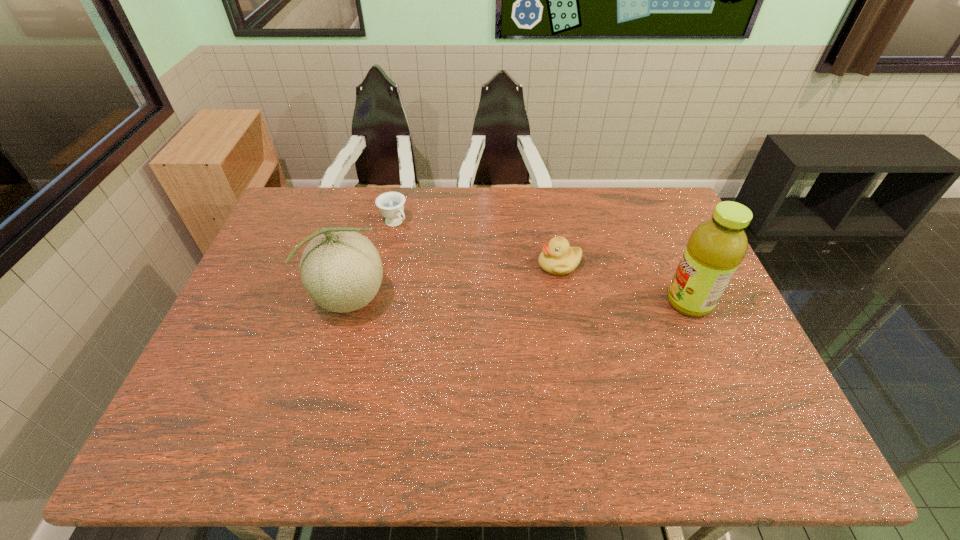
This screenshot has width=960, height=540. I want to click on cantaloup, so click(341, 270).

This screenshot has height=540, width=960. I want to click on fruit juice, so coord(716,247).

Locate an element on the screen. The image size is (960, 540). the shortest object is located at coordinates (391, 204).

Locate an element on the screen. Image resolution: width=960 pixels, height=540 pixels. the farthest object is located at coordinates (391, 204).

Where is `duckling`? duckling is located at coordinates (557, 257).

Locate an element on the screen. Image resolution: width=960 pixels, height=540 pixels. the second shortest object is located at coordinates (557, 257).

Image resolution: width=960 pixels, height=540 pixels. I want to click on free space located on the front of the cantaloup, so (x=334, y=371).

Where is `vacant space located 0.240m on the front label of the fruit juice`? The height and width of the screenshot is (540, 960). vacant space located 0.240m on the front label of the fruit juice is located at coordinates pyautogui.click(x=580, y=302).

This screenshot has height=540, width=960. In order to click on blank area located on the front label of the fruit juice in this screenshot , I will do `click(544, 302)`.

Locate an element on the screen. The image size is (960, 540). free space located 0.050m on the front label of the fruit juice is located at coordinates (648, 302).